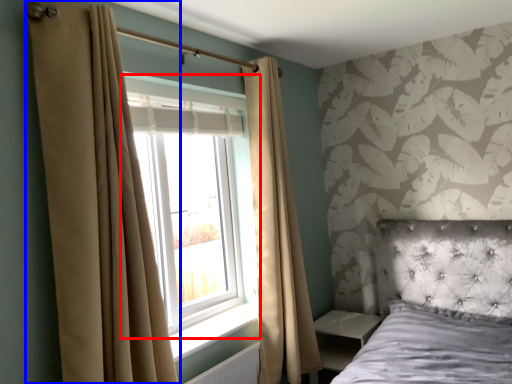
Question: Which object appears farthest to the camera in this image, window (highlighted by a red box) or curtain (highlighted by a blue box)?

Choices:
 (A) window
 (B) curtain

Answer: (A)